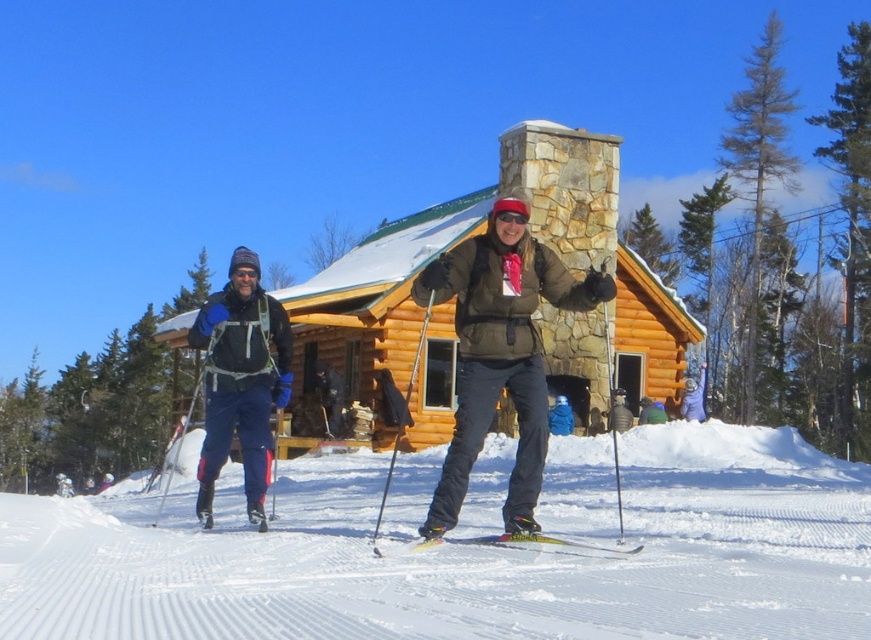
Question: Among these objects, which one is farthest from the camera?

Choices:
 (A) yellow metallic ski at center
 (B) brushed metal ski pole at left
 (C) brown wooden log cabin at center

Answer: (B)

Question: Can you confirm if white powdery snow at center is positioned above yellow metallic ski at center?

Choices:
 (A) yes
 (B) no

Answer: (B)

Question: Can you confirm if white powdery snow at center is positioned below yellow metallic ski at center?

Choices:
 (A) no
 (B) yes

Answer: (B)

Question: Can you confirm if brushed metal ski pole at left is thinner than yellow metallic ski at center?

Choices:
 (A) no
 (B) yes

Answer: (A)

Question: Which of the following is the closest to the observer?

Choices:
 (A) (819, 464)
 (B) (491, 545)
 (C) (274, 388)
 (D) (442, 308)

Answer: (B)

Question: Among these objects, which one is nearest to the camera?

Choices:
 (A) yellow metallic ski at center
 (B) brown wooden log cabin at center
 (C) white powdery snow at center

Answer: (C)